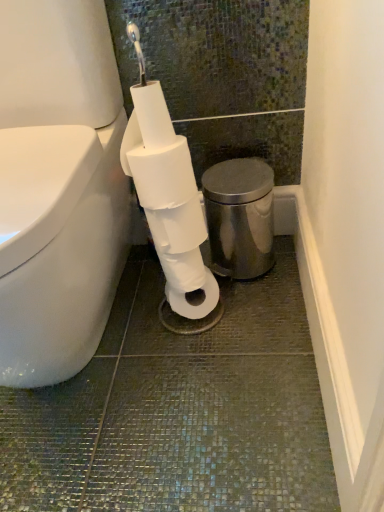
Question: Is white matte toilet paper at center, the first toilet paper in the bottom-to-top sequence, not close to polished stainless steel bidet at right?

Choices:
 (A) yes
 (B) no

Answer: (B)

Question: Can you confirm if white matte toilet paper at center, which is counted as the second toilet paper, starting from the top, is shorter than polished stainless steel bidet at right?

Choices:
 (A) no
 (B) yes

Answer: (B)

Question: Is white matte toilet paper at center, the first toilet paper in the bottom-to-top sequence, closer to the viewer compared to polished stainless steel bidet at right?

Choices:
 (A) yes
 (B) no

Answer: (A)

Question: From the image's perspective, would you say white matte toilet paper at center, which is counted as the second toilet paper, starting from the top, is shown under polished stainless steel bidet at right?

Choices:
 (A) yes
 (B) no

Answer: (A)

Question: From the image's perspective, does white matte toilet paper at center, which is counted as the second toilet paper, starting from the top, appear higher than polished stainless steel bidet at right?

Choices:
 (A) no
 (B) yes

Answer: (A)

Question: Is white matte toilet paper at center, the first toilet paper in the bottom-to-top sequence, taller than polished stainless steel bidet at right?

Choices:
 (A) no
 (B) yes

Answer: (A)

Question: From the image's perspective, is white matte toilet paper at center, positioned as the 1th toilet paper in top-to-bottom order, under white matte toilet paper at center, which is counted as the second toilet paper, starting from the top?

Choices:
 (A) no
 (B) yes

Answer: (A)

Question: From a real-world perspective, is white matte toilet paper at center, positioned as the 1th toilet paper in top-to-bottom order, located beneath white matte toilet paper at center, which is counted as the second toilet paper, starting from the top?

Choices:
 (A) yes
 (B) no

Answer: (B)

Question: Considering the relative positions of white matte toilet paper at center, positioned as the 1th toilet paper in top-to-bottom order, and white matte toilet paper at center, which is counted as the second toilet paper, starting from the top, in the image provided, is white matte toilet paper at center, positioned as the 1th toilet paper in top-to-bottom order, in front of white matte toilet paper at center, which is counted as the second toilet paper, starting from the top,?

Choices:
 (A) yes
 (B) no

Answer: (A)

Question: Does white matte toilet paper at center, positioned as the 1th toilet paper in top-to-bottom order, come behind white matte toilet paper at center, the first toilet paper in the bottom-to-top sequence?

Choices:
 (A) no
 (B) yes

Answer: (A)

Question: Is white matte toilet paper at center, the 2th toilet paper in the bottom-to-top sequence, not near white matte toilet paper at center, the first toilet paper in the bottom-to-top sequence?

Choices:
 (A) no
 (B) yes

Answer: (A)

Question: Considering the relative sizes of white matte toilet paper at center, positioned as the 1th toilet paper in top-to-bottom order, and white matte toilet paper at center, which is counted as the second toilet paper, starting from the top, in the image provided, is white matte toilet paper at center, positioned as the 1th toilet paper in top-to-bottom order, taller than white matte toilet paper at center, which is counted as the second toilet paper, starting from the top,?

Choices:
 (A) no
 (B) yes

Answer: (B)

Question: Is polished stainless steel bidet at right outside white matte toilet paper at center, which is counted as the second toilet paper, starting from the top?

Choices:
 (A) yes
 (B) no

Answer: (A)